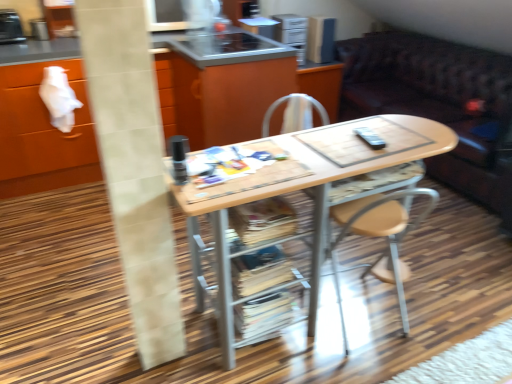
Question: Is white tile pillar at left not inside wooden cabinet at center?

Choices:
 (A) no
 (B) yes

Answer: (B)

Question: Is the position of white tile pillar at left more distant than that of wooden cabinet at center?

Choices:
 (A) no
 (B) yes

Answer: (A)

Question: Is white tile pillar at left thinner than wooden cabinet at center?

Choices:
 (A) no
 (B) yes

Answer: (B)

Question: Can you confirm if white tile pillar at left is shorter than wooden cabinet at center?

Choices:
 (A) yes
 (B) no

Answer: (B)

Question: Is white tile pillar at left closer to camera compared to wooden cabinet at center?

Choices:
 (A) yes
 (B) no

Answer: (A)

Question: From a real-world perspective, is white tile pillar at left positioned under wooden cabinet at center based on gravity?

Choices:
 (A) no
 (B) yes

Answer: (A)

Question: From the image's perspective, is wooden cabinet at center located beneath metallic silver microwave at upper center, which is the second appliance in back-to-front order?

Choices:
 (A) no
 (B) yes

Answer: (B)

Question: Is wooden cabinet at center closer to the viewer compared to metallic silver microwave at upper center, arranged as the second appliance when viewed from the left?

Choices:
 (A) yes
 (B) no

Answer: (A)

Question: Is metallic silver microwave at upper center, acting as the second appliance starting from the front, inside wooden cabinet at center?

Choices:
 (A) yes
 (B) no

Answer: (B)

Question: Can we say wooden cabinet at center lies outside metallic silver microwave at upper center, which is the 2th appliance from right to left?

Choices:
 (A) yes
 (B) no

Answer: (A)

Question: Is wooden cabinet at center shorter than metallic silver microwave at upper center, which is the 2th appliance from right to left?

Choices:
 (A) yes
 (B) no

Answer: (B)

Question: Is wooden cabinet at center positioned far away from metallic silver microwave at upper center, which is the second appliance in back-to-front order?

Choices:
 (A) yes
 (B) no

Answer: (A)

Question: Are metallic stainless steel toaster at upper left, the first appliance in the left-to-right sequence, and wooden cabinet at center far apart?

Choices:
 (A) no
 (B) yes

Answer: (A)